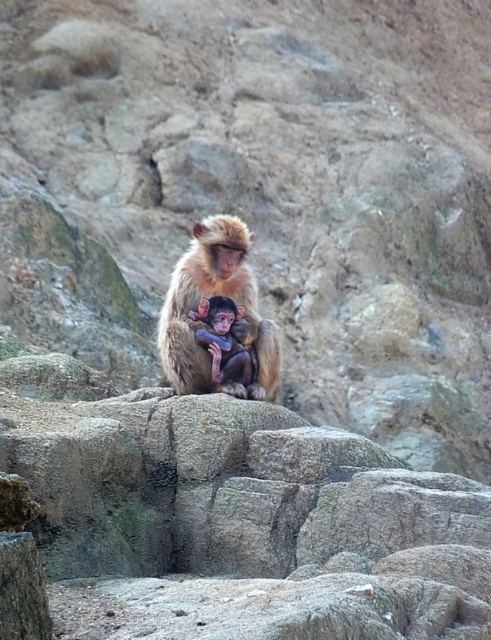
Question: Which of the following is the closest to the observer?

Choices:
 (A) soft brown fur monkey at center
 (B) furry brown monkey at center

Answer: (A)

Question: Which point is farther to the camera?

Choices:
 (A) (190, 388)
 (B) (239, 346)

Answer: (B)

Question: Among these objects, which one is nearest to the camera?

Choices:
 (A) furry brown monkey at center
 (B) soft brown fur monkey at center

Answer: (B)

Question: Is furry brown monkey at center bigger than soft brown fur monkey at center?

Choices:
 (A) yes
 (B) no

Answer: (A)

Question: From the image, what is the correct spatial relationship of furry brown monkey at center in relation to soft brown fur monkey at center?

Choices:
 (A) above
 (B) below

Answer: (A)

Question: Is furry brown monkey at center closer to the viewer compared to soft brown fur monkey at center?

Choices:
 (A) yes
 (B) no

Answer: (B)